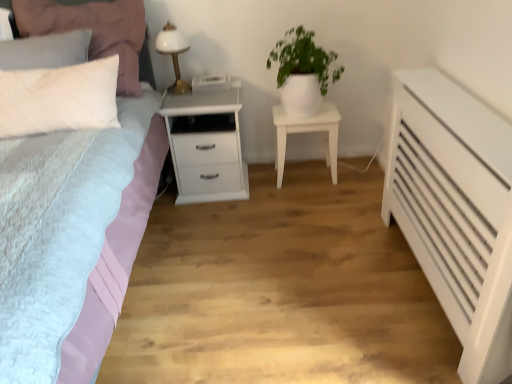
Question: Is white matte nightstand at center, the 1th nightstand viewed from the right, further to the viewer compared to white quilted pillow at upper left?

Choices:
 (A) no
 (B) yes

Answer: (B)

Question: From a real-world perspective, is white matte nightstand at center, positioned as the 2th nightstand in left-to-right order, on white quilted pillow at upper left?

Choices:
 (A) yes
 (B) no

Answer: (B)

Question: Is white matte nightstand at center, positioned as the 2th nightstand in left-to-right order, outside white quilted pillow at upper left?

Choices:
 (A) yes
 (B) no

Answer: (A)

Question: Is white matte nightstand at center, the 1th nightstand viewed from the right, oriented away from white quilted pillow at upper left?

Choices:
 (A) yes
 (B) no

Answer: (B)

Question: From a real-world perspective, is white matte nightstand at center, the 1th nightstand viewed from the right, under white quilted pillow at upper left?

Choices:
 (A) yes
 (B) no

Answer: (A)

Question: Can you confirm if white matte nightstand at center, positioned as the 2th nightstand in left-to-right order, is positioned to the left of white quilted pillow at upper left?

Choices:
 (A) no
 (B) yes

Answer: (A)

Question: Is white glossy nightstand at center, which appears as the second nightstand when viewed from the right, at the left side of matte pink bed at left?

Choices:
 (A) yes
 (B) no

Answer: (B)

Question: Considering the relative positions of white glossy nightstand at center, which is the first nightstand from left to right, and matte pink bed at left in the image provided, is white glossy nightstand at center, which is the first nightstand from left to right, to the right of matte pink bed at left from the viewer's perspective?

Choices:
 (A) yes
 (B) no

Answer: (A)

Question: Can you confirm if white glossy nightstand at center, which appears as the second nightstand when viewed from the right, is thinner than matte pink bed at left?

Choices:
 (A) no
 (B) yes

Answer: (B)

Question: Is white glossy nightstand at center, which is the first nightstand from left to right, positioned far away from matte pink bed at left?

Choices:
 (A) yes
 (B) no

Answer: (B)

Question: Does white glossy nightstand at center, which is the first nightstand from left to right, have a greater width compared to matte pink bed at left?

Choices:
 (A) yes
 (B) no

Answer: (B)

Question: Can you confirm if white glossy nightstand at center, which is the first nightstand from left to right, is shorter than matte pink bed at left?

Choices:
 (A) no
 (B) yes

Answer: (B)

Question: Is white matte nightstand at center, the 1th nightstand viewed from the right, located within white matte pot at upper center?

Choices:
 (A) yes
 (B) no

Answer: (B)